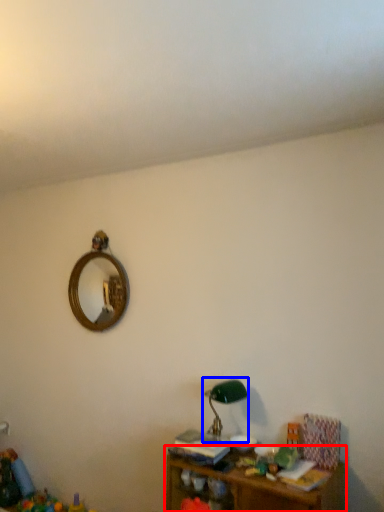
Question: Among these objects, which one is nearest to the camera, shelf (highlighted by a red box) or table lamp (highlighted by a blue box)?

Choices:
 (A) shelf
 (B) table lamp

Answer: (A)